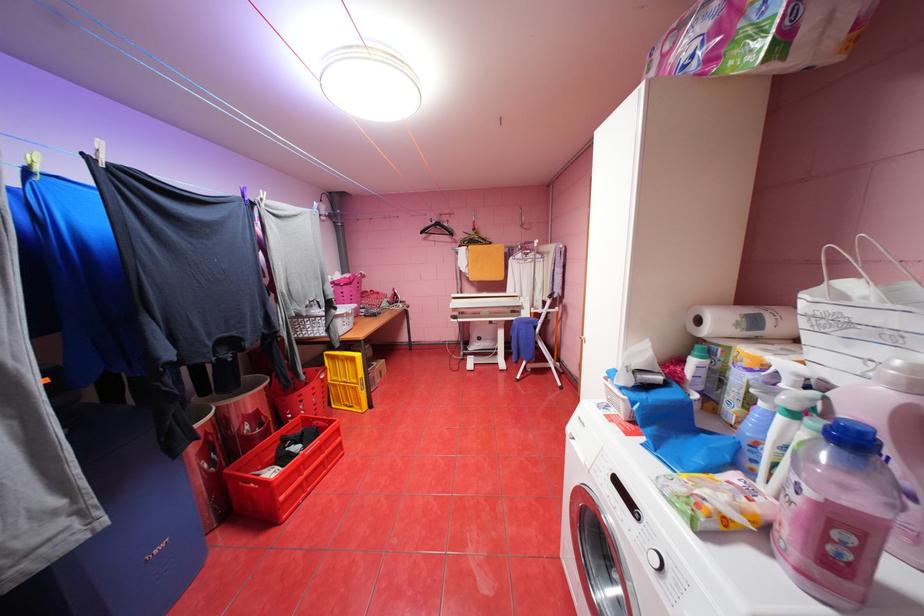
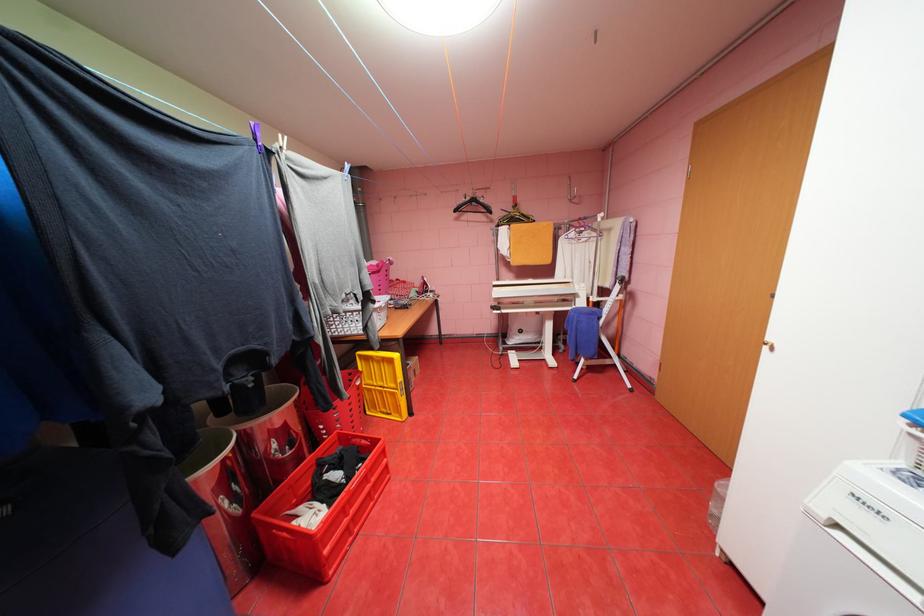
Question: The first image is from the beginning of the video and the second image is from the end. How did the camera likely rotate when shooting the video?

Choices:
 (A) Left
 (B) Right
 (C) Up
 (D) Down

Answer: (D)